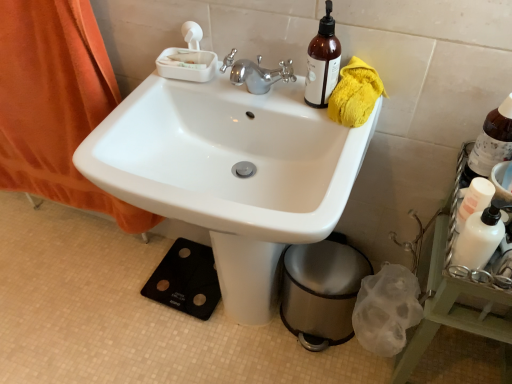
Find the location of a particular element. blank space above metallic trash can at lower right (from a real-world perspective) is located at coordinates (330, 268).